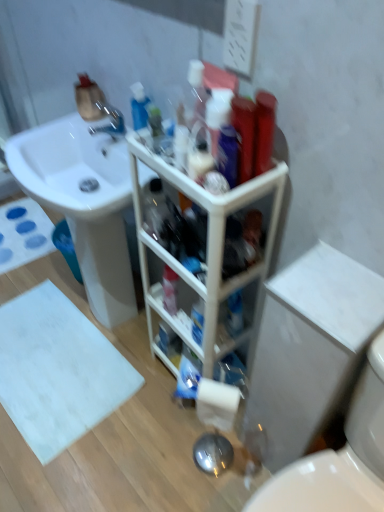
This screenshot has width=384, height=512. I want to click on vacant space to the right of white matte bath mat at lower left, the 1th bath mat viewed from the front, so click(144, 398).